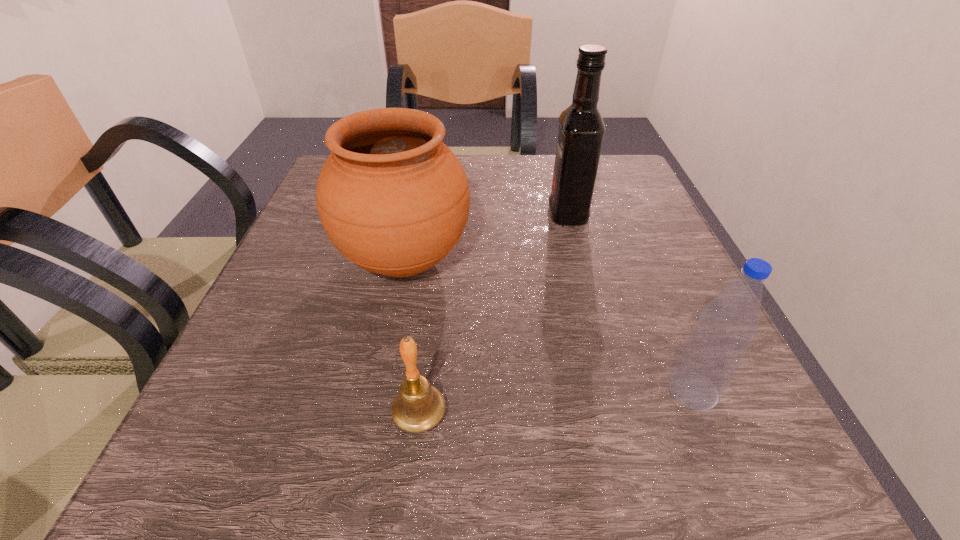
The image size is (960, 540). In order to click on free space at the right edge in this screenshot , I will do `click(643, 253)`.

Locate an element on the screen. vacant space at the near left corner is located at coordinates (249, 454).

Where is `free space between the pottery and the water bottle`? free space between the pottery and the water bottle is located at coordinates (548, 325).

Where is `vacant space in between the rightmost object and the bell`? vacant space in between the rightmost object and the bell is located at coordinates (556, 402).

Image resolution: width=960 pixels, height=540 pixels. I want to click on free spot between the water bottle and the pottery, so click(548, 325).

Where is `free space between the rightmost object and the tallest object`? free space between the rightmost object and the tallest object is located at coordinates (631, 302).

You are a GUI agent. You are given a task and a screenshot of the screen. Output one action in this format:
    pyautogui.click(x=<x>, y=<y>)
    Task: Click on the free point between the water bottle and the bell
    
    Given the screenshot: What is the action you would take?
    pyautogui.click(x=556, y=402)

I want to click on unoccupied position between the rightmost object and the pottery, so pyautogui.click(x=548, y=325).

Find the location of a particular element. The width and height of the screenshot is (960, 540). free space between the bell and the third object from left to right is located at coordinates (493, 314).

Where is `vacant region between the water bottle and the shortest object`? This screenshot has width=960, height=540. vacant region between the water bottle and the shortest object is located at coordinates (556, 402).